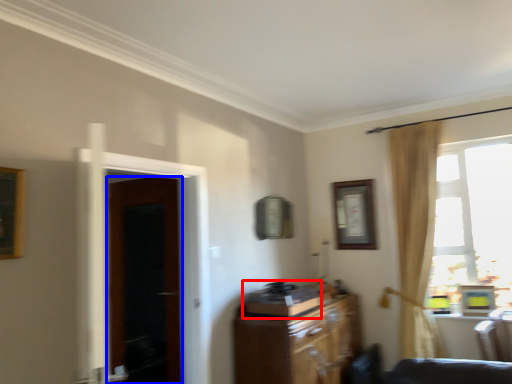
Question: Among these objects, which one is farthest to the camera, appliance (highlighted by a red box) or door (highlighted by a blue box)?

Choices:
 (A) appliance
 (B) door

Answer: (B)